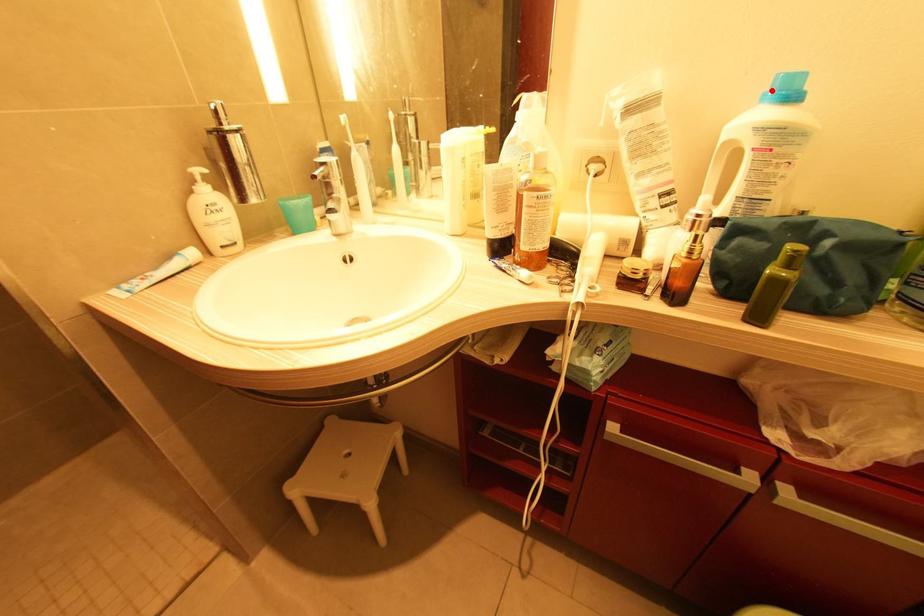
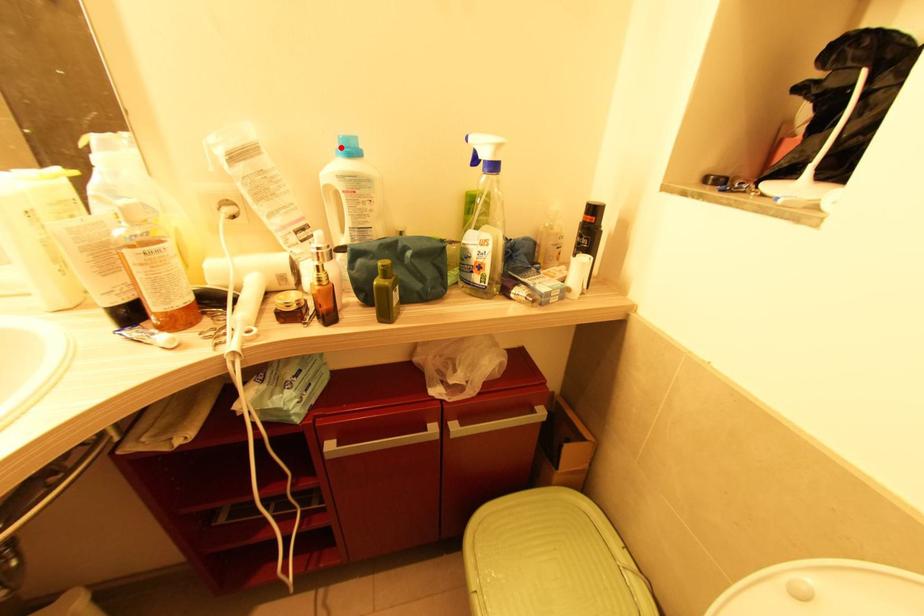
I am providing you with two images of the same scene from different viewpoints. A red point is marked on the first image and another point is marked on the second image. Are the points marked in image1 and image2 representing the same 3D position?

Yes